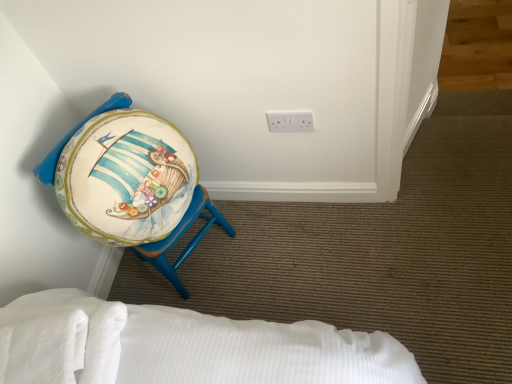
Where is `empty space that is to the right of matte painted stool at left`? This screenshot has height=384, width=512. empty space that is to the right of matte painted stool at left is located at coordinates (261, 238).